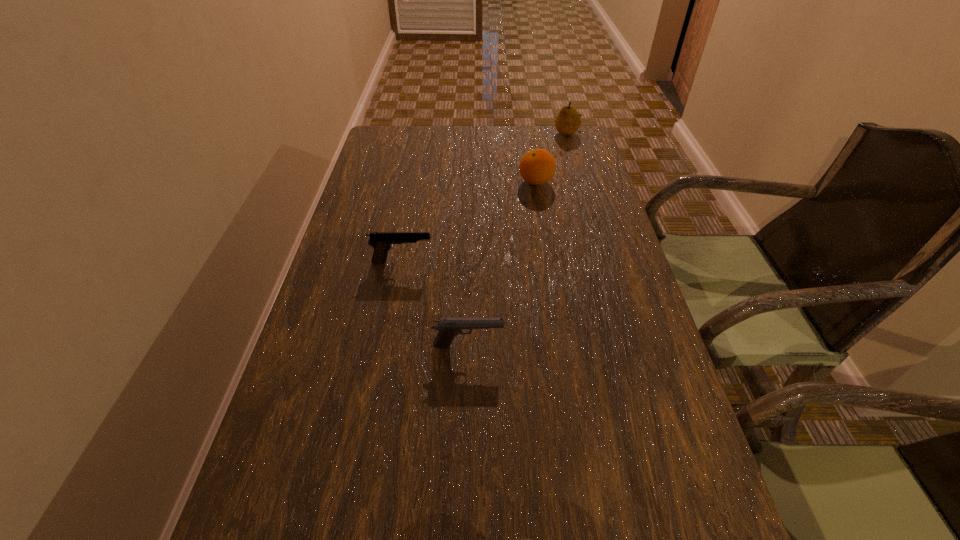
Identify the location of free space located 0.180m at the barrel of the fourth farthest object. coord(589,346).

Locate an element on the screen. object at the far edge is located at coordinates (567, 122).

Where is `object that is at the left edge`? The height and width of the screenshot is (540, 960). object that is at the left edge is located at coordinates (382, 242).

The height and width of the screenshot is (540, 960). In order to click on pear situated at the right edge in this screenshot , I will do `click(567, 122)`.

Image resolution: width=960 pixels, height=540 pixels. Identify the location of orange that is at the right edge. (537, 167).

I want to click on object positioned at the far right corner, so click(567, 122).

The height and width of the screenshot is (540, 960). What are the coordinates of `vacant space at the far edge of the desktop` in the screenshot? It's located at (442, 130).

In the image, there is a desktop. Where is `blank space at the left edge`? The image size is (960, 540). blank space at the left edge is located at coordinates (396, 228).

Where is `free space at the right edge of the desktop`? The width and height of the screenshot is (960, 540). free space at the right edge of the desktop is located at coordinates (584, 336).

Locate an element on the screen. The height and width of the screenshot is (540, 960). free region at the far left corner of the desktop is located at coordinates (380, 143).